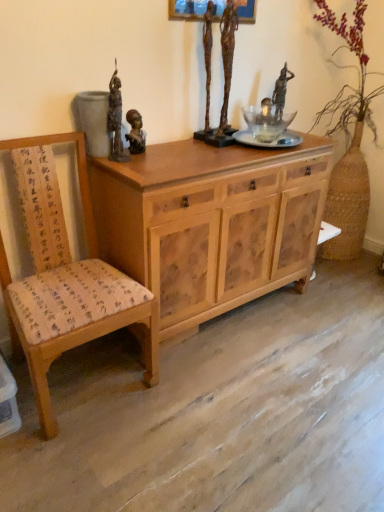
This screenshot has height=512, width=384. I want to click on braided straw vase at right, so click(351, 142).

The height and width of the screenshot is (512, 384). What do you see at coordinates (135, 132) in the screenshot? I see `bronze statue at center, which is the third person from back to front` at bounding box center [135, 132].

The width and height of the screenshot is (384, 512). What are the coordinates of `natural wood cabinet at center` in the screenshot? It's located at (211, 223).

What do you see at coordinates (281, 91) in the screenshot?
I see `bronze statue at upper center, which is the 1th person from right to left` at bounding box center [281, 91].

Locate an element on the screen. The height and width of the screenshot is (512, 384). transparent glass vase at upper center, marked as the third person in a front-to-back arrangement is located at coordinates (266, 112).

What are the coordinates of `bronze statue at center, which ranks as the 1th sculpture in right-to-left order` in the screenshot? It's located at (224, 79).

At what (x,y) coordinates should I click in order to perform the action: click on braided straw vase at right. Please return your answer as a coordinate pair (x, y). Image resolution: width=384 pixels, height=512 pixels. Looking at the image, I should click on (351, 142).

Between point (114, 94) and point (134, 145), which one is positioned in front?

Positioned in front is point (114, 94).

Considering the relative positions of bronze statue at upper left, which ranks as the 2th sculpture in right-to-left order, and bronze statue at center, which is the third person from back to front, in the image provided, is bronze statue at upper left, which ranks as the 2th sculpture in right-to-left order, to the left or to the right of bronze statue at center, which is the third person from back to front,?

bronze statue at upper left, which ranks as the 2th sculpture in right-to-left order, is positioned on bronze statue at center, which is the third person from back to front,'s left side.

Between bronze statue at upper left, which is the first sculpture from left to right, and bronze statue at center, which is the third person from back to front, which one has larger width?

bronze statue at upper left, which is the first sculpture from left to right, is wider.

Is bronze statue at upper left, which is the first sculpture from left to right, in front of wooden chair with fabric cushion at left?

No, bronze statue at upper left, which is the first sculpture from left to right, is further to the viewer.

Is bronze statue at upper left, which ranks as the 2th sculpture in right-to-left order, to the right of wooden chair with fabric cushion at left from the viewer's perspective?

Yes.

Locate an element on the screen. The height and width of the screenshot is (512, 384). the 1st sculpture positioned above the wooden chair with fabric cushion at left (from the image's perspective) is located at coordinates (116, 119).

From the image's perspective, is bronze statue at upper left, which is the first sculpture from left to right, above or below wooden chair with fabric cushion at left?

Clearly, from the image's perspective, bronze statue at upper left, which is the first sculpture from left to right, is above wooden chair with fabric cushion at left.

Would you say bronze statue at center, marked as the first person in a front-to-back arrangement, is outside bronze statue at upper center, which is the 1th person from right to left?

Absolutely, bronze statue at center, marked as the first person in a front-to-back arrangement, is external to bronze statue at upper center, which is the 1th person from right to left.

Are bronze statue at center, which is the third person from back to front, and bronze statue at upper center, the 2th person from the front, located far from each other?

bronze statue at center, which is the third person from back to front, is actually quite close to bronze statue at upper center, the 2th person from the front.

Looking at this image, which is more to the left, bronze statue at center, which ranks as the third person in right-to-left order, or bronze statue at upper center, the 2th person from the front?

Positioned to the left is bronze statue at center, which ranks as the third person in right-to-left order.

From a real-world perspective, which object stands above the other?

From a 3D spatial view, bronze statue at upper center, which is the 1th person from right to left, is above.

Looking at this image, between wooden chair with fabric cushion at left and bronze statue at upper center, the 2th person from the front, which one has smaller width?

bronze statue at upper center, the 2th person from the front, is thinner.

Considering the relative sizes of wooden chair with fabric cushion at left and bronze statue at upper center, the 2th person from the front, in the image provided, is wooden chair with fabric cushion at left bigger than bronze statue at upper center, the 2th person from the front,?

Yes, wooden chair with fabric cushion at left is bigger than bronze statue at upper center, the 2th person from the front.

Is wooden chair with fabric cushion at left beside bronze statue at upper center, which is counted as the 3th person, starting from the left?

wooden chair with fabric cushion at left and bronze statue at upper center, which is counted as the 3th person, starting from the left, are not in contact.

Starting from the wooden chair with fabric cushion at left, which person is the 3rd one to the right? Please provide its 2D coordinates.

[(281, 91)]

Is natural wood cabinet at center facing towards bronze statue at upper center, which is the 1th person from right to left?

No, natural wood cabinet at center is not facing towards bronze statue at upper center, which is the 1th person from right to left.

At what (x,y) coordinates should I click in order to perform the action: click on cabinetry on the left of bronze statue at upper center, which is counted as the second person, starting from the back. Please return your answer as a coordinate pair (x, y). The width and height of the screenshot is (384, 512). Looking at the image, I should click on (211, 223).

Is natural wood cabinet at center bigger or smaller than bronze statue at upper center, which is the 1th person from right to left?

In the image, natural wood cabinet at center appears to be larger than bronze statue at upper center, which is the 1th person from right to left.

How many degrees apart are the facing directions of natural wood cabinet at center and bronze statue at upper center, the 2th person from the front?

The facing directions of natural wood cabinet at center and bronze statue at upper center, the 2th person from the front, are 6.9 degrees apart.

Is bronze statue at center, which ranks as the 1th sculpture in right-to-left order, turned away from bronze statue at center, which is the third person from back to front?

No, bronze statue at center, which is the third person from back to front, is not at the back of bronze statue at center, which ranks as the 1th sculpture in right-to-left order.

This screenshot has height=512, width=384. In order to click on the 2nd person positioned below the bronze statue at center, the 2th sculpture in the left-to-right sequence (from a real-world perspective) in this screenshot , I will do `click(135, 132)`.

Is bronze statue at center, which ranks as the 1th sculpture in right-to-left order, taller or shorter than bronze statue at center, which is the third person from back to front?

Clearly, bronze statue at center, which ranks as the 1th sculpture in right-to-left order, is taller compared to bronze statue at center, which is the third person from back to front.

Which is behind, bronze statue at center, the 2th sculpture in the left-to-right sequence, or bronze statue at center, the first person in the left-to-right sequence?

bronze statue at center, the first person in the left-to-right sequence, is more distant.

Considering the relative sizes of natural wood cabinet at center and bronze statue at upper left, which is the first sculpture from left to right, in the image provided, is natural wood cabinet at center smaller than bronze statue at upper left, which is the first sculpture from left to right,?

Actually, natural wood cabinet at center might be larger than bronze statue at upper left, which is the first sculpture from left to right.

From the image's perspective, which is above, natural wood cabinet at center or bronze statue at upper left, which ranks as the 2th sculpture in right-to-left order?

bronze statue at upper left, which ranks as the 2th sculpture in right-to-left order, is shown above in the image.

Is there a large distance between natural wood cabinet at center and bronze statue at upper left, which is the first sculpture from left to right?

They are positioned close to each other.

You are a GUI agent. You are given a task and a screenshot of the screen. Output one action in this format:
    pyautogui.click(x=<x>, y=<y>)
    Task: Click on the person that is the 1st one when counting rightward from the bronze statue at upper left, which ranks as the 2th sculpture in right-to-left order
    The width and height of the screenshot is (384, 512).
    Given the screenshot: What is the action you would take?
    pyautogui.click(x=135, y=132)

You are a GUI agent. You are given a task and a screenshot of the screen. Output one action in this format:
    pyautogui.click(x=<x>, y=<y>)
    Task: Click on the chair in front of the bronze statue at upper left, which ranks as the 2th sculpture in right-to-left order
    
    Given the screenshot: What is the action you would take?
    pyautogui.click(x=64, y=277)

Based on their spatial positions, is braided straw vase at right or natural wood cabinet at center closer to bronze statue at center, which is the third person from back to front?

Among the two, natural wood cabinet at center is located nearer to bronze statue at center, which is the third person from back to front.

Considering their positions, is bronze statue at upper center, the 2th person from the front, positioned closer to braided straw vase at right than natural wood cabinet at center?

Based on the image, bronze statue at upper center, the 2th person from the front, appears to be nearer to braided straw vase at right.

Estimate the real-world distances between objects in this image. Which object is closer to bronze statue at upper center, the 2th person from the front, wooden chair with fabric cushion at left or bronze statue at upper left, which ranks as the 2th sculpture in right-to-left order?

bronze statue at upper left, which ranks as the 2th sculpture in right-to-left order.

Based on their spatial positions, is wooden chair with fabric cushion at left or bronze statue at center, which ranks as the 1th sculpture in right-to-left order, closer to braided straw vase at right?

bronze statue at center, which ranks as the 1th sculpture in right-to-left order, is positioned closer to the anchor braided straw vase at right.

Considering their positions, is transparent glass vase at upper center, the first person from the back, positioned further to bronze statue at center, which ranks as the 1th sculpture in right-to-left order, than braided straw vase at right?

braided straw vase at right lies further to bronze statue at center, which ranks as the 1th sculpture in right-to-left order, than the other object.

Estimate the real-world distances between objects in this image. Which object is further from bronze statue at upper center, which is the 1th person from right to left, wooden chair with fabric cushion at left or bronze statue at center, the 2th sculpture in the left-to-right sequence?

wooden chair with fabric cushion at left.

When comparing their distances from bronze statue at upper center, which is counted as the second person, starting from the back, does bronze statue at upper left, which is the first sculpture from left to right, or bronze statue at center, which is the third person from back to front, seem further?

The object further to bronze statue at upper center, which is counted as the second person, starting from the back, is bronze statue at upper left, which is the first sculpture from left to right.

Which object lies further to the anchor point wooden chair with fabric cushion at left, transparent glass vase at upper center, marked as the third person in a front-to-back arrangement, or bronze statue at center, which is the third person from back to front?

transparent glass vase at upper center, marked as the third person in a front-to-back arrangement, lies further to wooden chair with fabric cushion at left than the other object.

The image size is (384, 512). I want to click on sculpture between bronze statue at upper left, which is the first sculpture from left to right, and transparent glass vase at upper center, which appears as the 2th person when viewed from the right, so 224,79.

The image size is (384, 512). In order to click on cabinetry between wooden chair with fabric cushion at left and braided straw vase at right from left to right in this screenshot , I will do click(211, 223).

The height and width of the screenshot is (512, 384). In order to click on person between bronze statue at upper left, which is the first sculpture from left to right, and wooden chair with fabric cushion at left in the up-down direction in this screenshot , I will do `click(135, 132)`.

At what (x,y) coordinates should I click in order to perform the action: click on person located between bronze statue at upper left, which is the first sculpture from left to right, and bronze statue at center, the 2th sculpture in the left-to-right sequence, in the left-right direction. Please return your answer as a coordinate pair (x, y). Looking at the image, I should click on (135, 132).